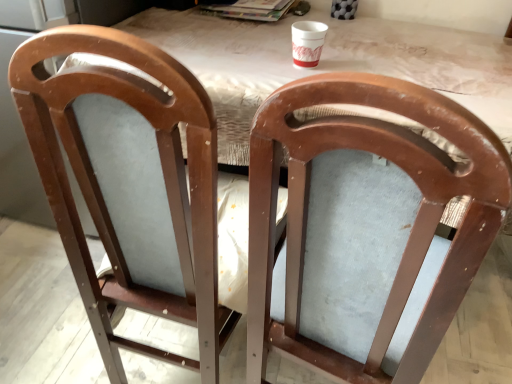
Question: Is matte wood chair at center, arranged as the 1th chair when viewed from the left, inside the boundaries of matte wood chair at center, which ranks as the 1th chair in right-to-left order, or outside?

Choices:
 (A) outside
 (B) inside

Answer: (A)

Question: Is matte wood chair at center, placed as the 2th chair when sorted from right to left, wider or thinner than matte wood chair at center, which ranks as the 1th chair in right-to-left order?

Choices:
 (A) thin
 (B) wide

Answer: (A)

Question: Estimate the real-world distances between objects in this image. Which object is farther from the matte wood table at center?

Choices:
 (A) matte wood chair at center, placed as the 2th chair when sorted from right to left
 (B) white paper cup at upper center
 (C) matte wood chair at center, the second chair in the left-to-right sequence

Answer: (A)

Question: Estimate the real-world distances between objects in this image. Which object is closer to the matte wood chair at center, placed as the 2th chair when sorted from right to left?

Choices:
 (A) white paper cup at upper center
 (B) matte wood chair at center, which ranks as the 1th chair in right-to-left order
 (C) matte wood table at center

Answer: (B)